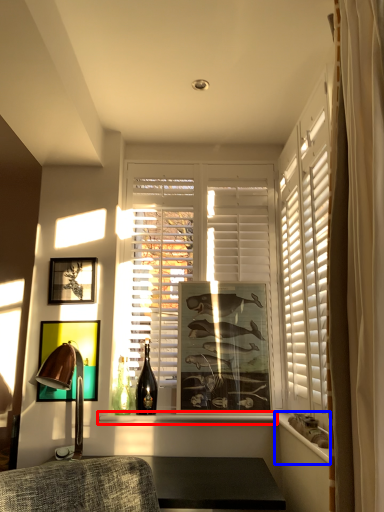
Question: Which point is further to the camera, window sill (highlighted by a red box) or ledge (highlighted by a blue box)?

Choices:
 (A) window sill
 (B) ledge

Answer: (A)